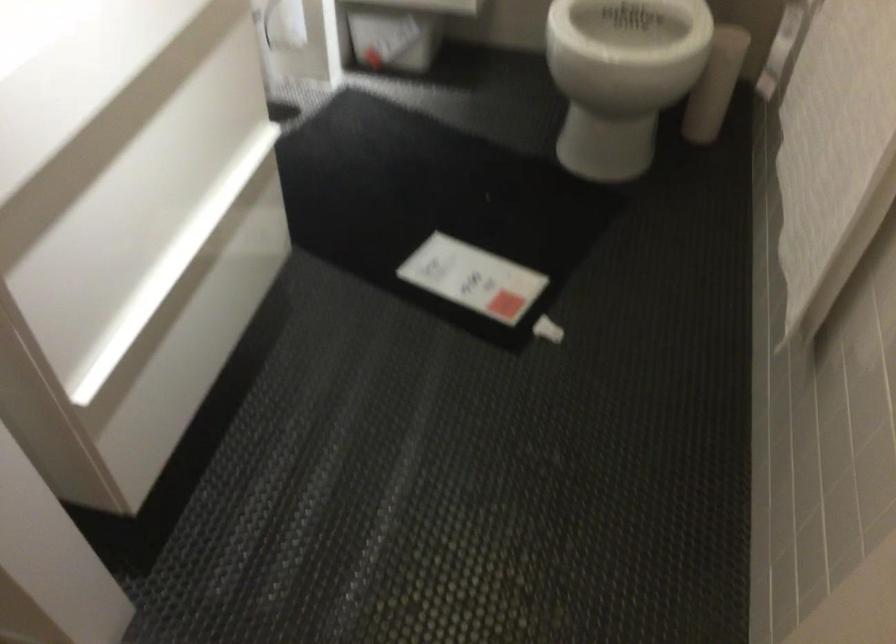
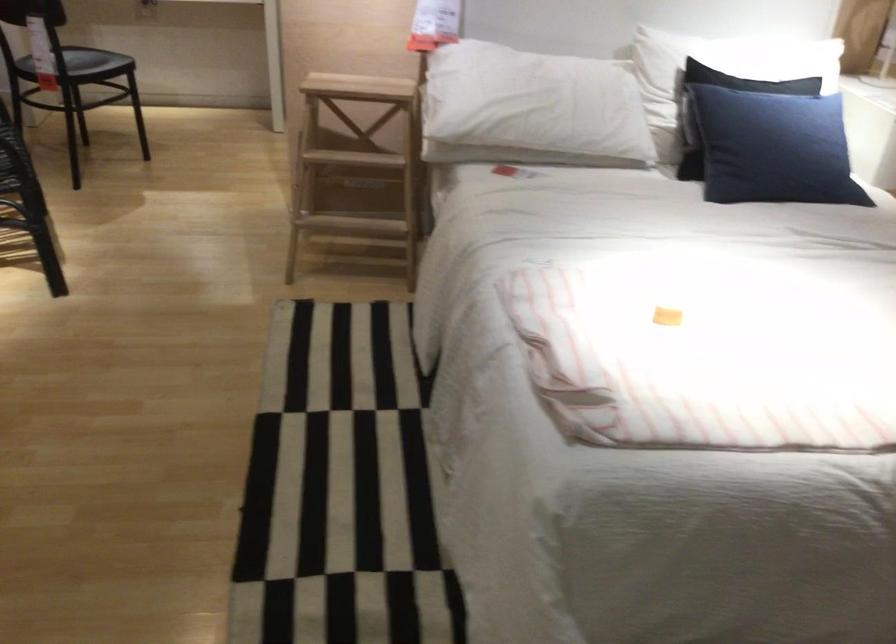
Question: I am providing you with two images of the same scene from different viewpoints. Which of the following objects are not visible in image2?

Choices:
 (A) striped folded blanket
 (B) blue pillow
 (C) white cylindrical holder
 (D) brown cover book

Answer: (C)